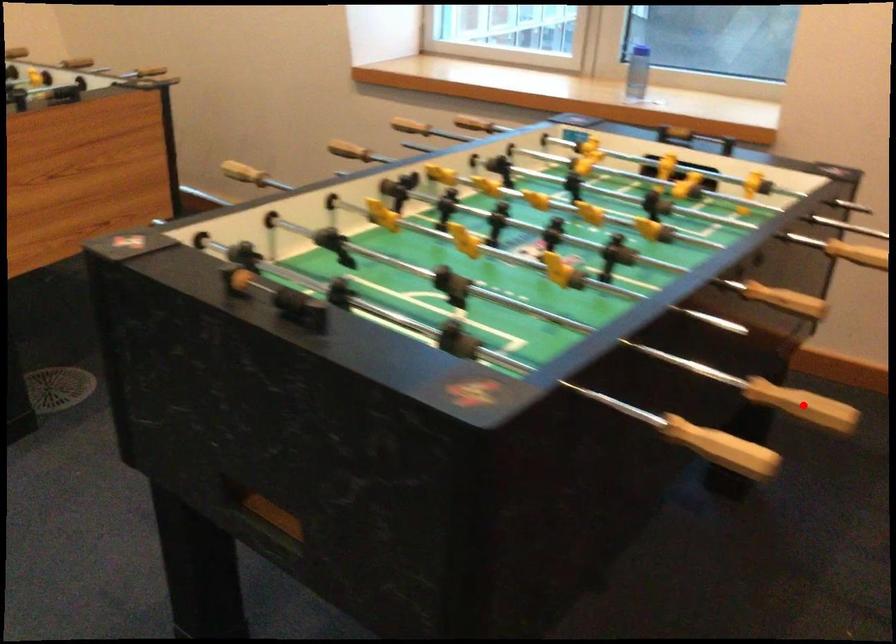
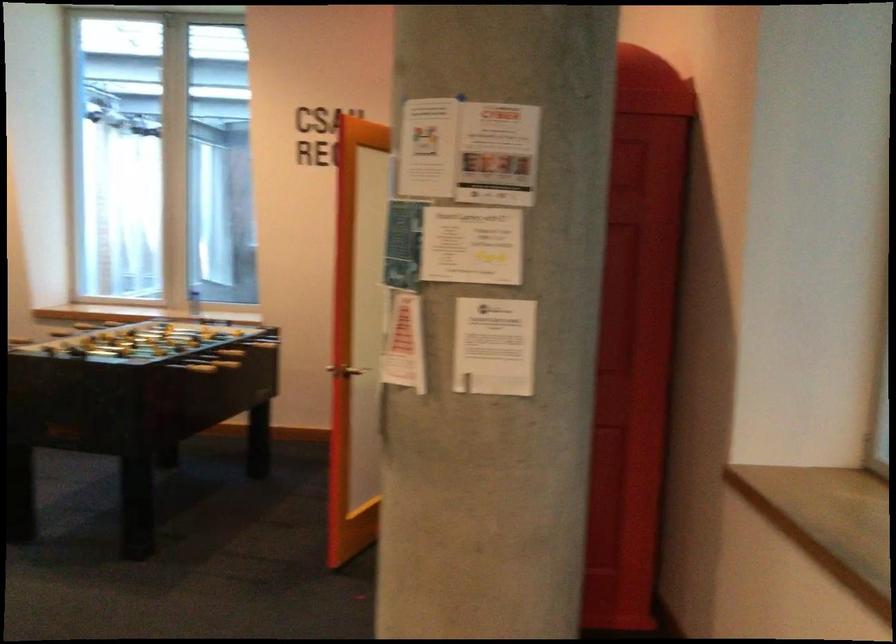
Question: I am providing you with two images of the same scene from different viewpoints. A red point is marked on the first image. Can you still see the location of the red point in image 2?

Choices:
 (A) Yes
 (B) No

Answer: (B)